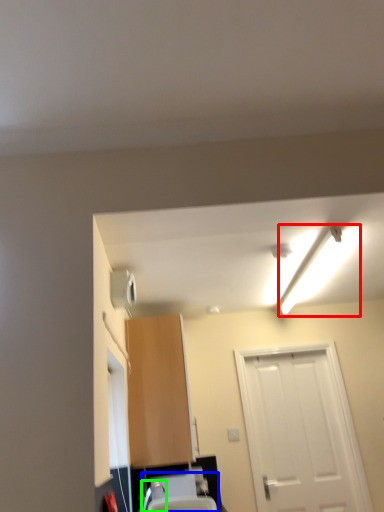
Question: Which object is positioned closest to light fixture (highlighted by a red box)? Select from sink (highlighted by a blue box) and faucet (highlighted by a green box).

Choices:
 (A) sink
 (B) faucet

Answer: (A)